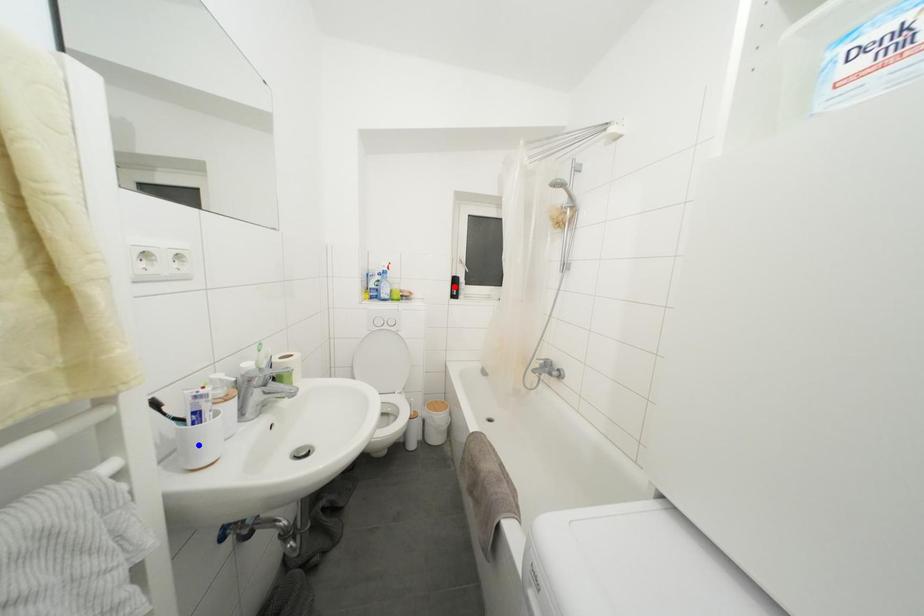
Question: Two points are marked on the image. Which point is closer to the camera?

Choices:
 (A) Blue point is closer.
 (B) Red point is closer.

Answer: (A)